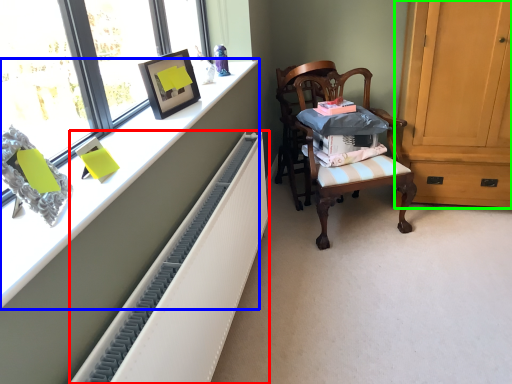
Question: Which is nearer to the radiator (highlighted by a red box)? desk (highlighted by a blue box) or cabinetry (highlighted by a green box).

Choices:
 (A) desk
 (B) cabinetry

Answer: (A)